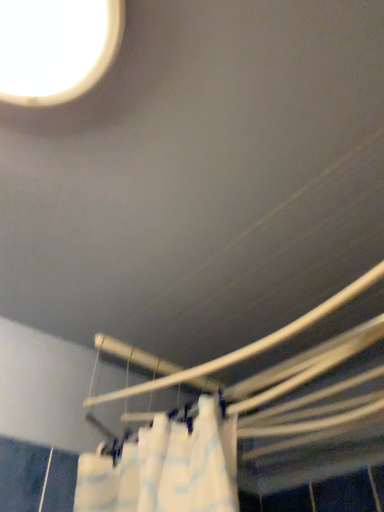
In order to face white glossy droplight at upper left, should I rotate leftwards or rightwards?

A 24.955 degree turn to the left will do.

Describe the element at coordinates (56, 48) in the screenshot. I see `white glossy droplight at upper left` at that location.

Locate an element on the screen. This screenshot has width=384, height=512. white glossy droplight at upper left is located at coordinates (56, 48).

You are a GUI agent. You are given a task and a screenshot of the screen. Output one action in this format:
    pyautogui.click(x=<x>, y=<y>)
    Task: Click on the white glossy droplight at upper left
    
    Given the screenshot: What is the action you would take?
    pyautogui.click(x=56, y=48)